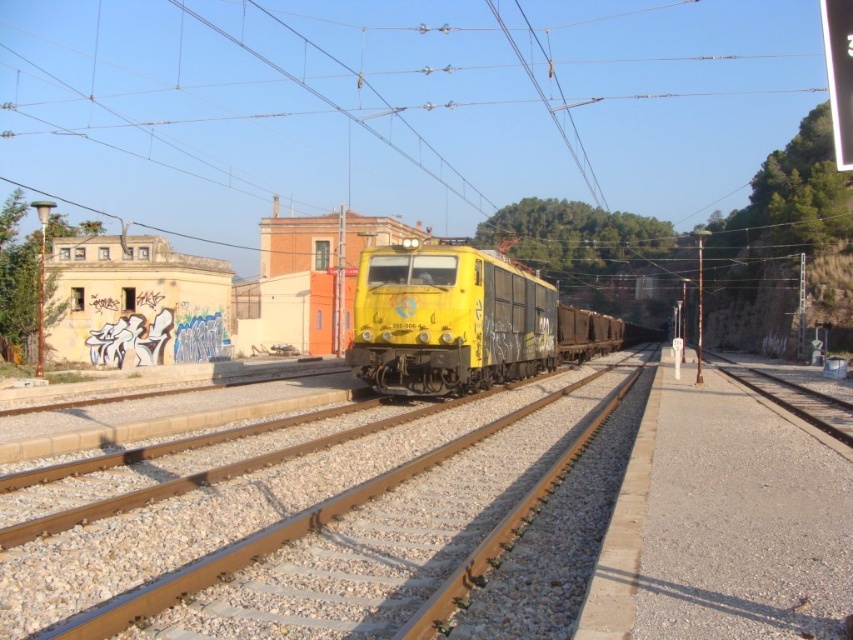
Can you confirm if yellow metal train at center is bigger than yellow matte train at center?

Incorrect, yellow metal train at center is not larger than yellow matte train at center.

Which is in front, point (277, 586) or point (503, 296)?

Positioned in front is point (277, 586).

Identify the location of yellow metal train at center. (303, 532).